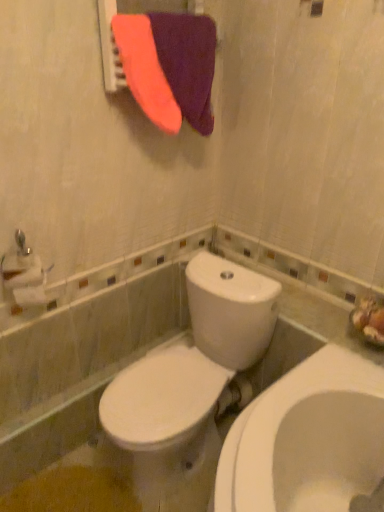
Question: From a real-world perspective, is white matte toilet paper at left below purple fabric at upper center?

Choices:
 (A) yes
 (B) no

Answer: (A)

Question: From the image's perspective, is white matte toilet paper at left located above purple fabric at upper center?

Choices:
 (A) no
 (B) yes

Answer: (A)

Question: Is white matte toilet paper at left bigger than purple fabric at upper center?

Choices:
 (A) no
 (B) yes

Answer: (A)

Question: Is white matte toilet paper at left in front of purple fabric at upper center?

Choices:
 (A) no
 (B) yes

Answer: (A)

Question: From the image's perspective, does white matte toilet paper at left appear lower than purple fabric at upper center?

Choices:
 (A) no
 (B) yes

Answer: (B)

Question: Is point (11, 260) positioned closer to the camera than point (200, 73)?

Choices:
 (A) farther
 (B) closer

Answer: (B)

Question: From the image's perspective, is white matte toilet paper at left above or below purple soft towel at upper center?

Choices:
 (A) above
 (B) below

Answer: (B)

Question: Is white matte toilet paper at left to the left or to the right of purple soft towel at upper center in the image?

Choices:
 (A) left
 (B) right

Answer: (A)

Question: Relative to purple soft towel at upper center, is white matte toilet paper at left in front or behind?

Choices:
 (A) front
 (B) behind

Answer: (B)

Question: In terms of width, does white matte toilet paper at left look wider or thinner when compared to purple fabric at upper center?

Choices:
 (A) thin
 (B) wide

Answer: (A)

Question: From the image's perspective, is white matte toilet paper at left positioned above or below purple fabric at upper center?

Choices:
 (A) above
 (B) below

Answer: (B)

Question: Does point (19, 275) appear closer or farther from the camera than point (99, 14)?

Choices:
 (A) farther
 (B) closer

Answer: (A)

Question: From a real-world perspective, is white matte toilet paper at left positioned above or below purple fabric at upper center?

Choices:
 (A) below
 (B) above

Answer: (A)

Question: From their relative heights in the image, would you say white glossy toilet at center is taller or shorter than purple fabric at upper center?

Choices:
 (A) tall
 (B) short

Answer: (A)

Question: Considering the positions of point (193, 349) and point (201, 6), is point (193, 349) closer or farther from the camera than point (201, 6)?

Choices:
 (A) closer
 (B) farther

Answer: (B)